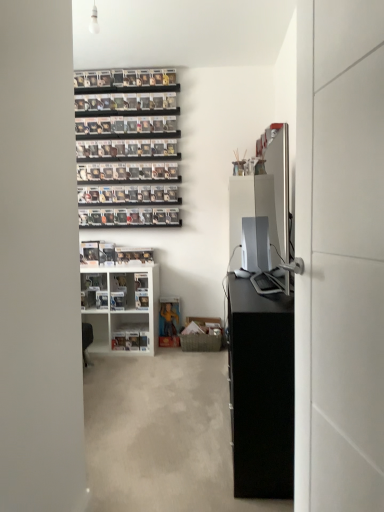
What do you see at coordinates (261, 390) in the screenshot? This screenshot has width=384, height=512. I see `black matte cabinet at right` at bounding box center [261, 390].

The image size is (384, 512). I want to click on white glossy door at right, so click(339, 256).

Locate an element on the screen. The width and height of the screenshot is (384, 512). satin silver desktop at center is located at coordinates (255, 244).

How much space does white glossy shelf at center, which appears as the second shelf when ordered from the bottom, occupy vertically?

white glossy shelf at center, which appears as the second shelf when ordered from the bottom, is 29.50 inches tall.

Measure the distance between point [116,335] and camera.

The depth of point [116,335] is 11.99 feet.

The height and width of the screenshot is (512, 384). I want to click on white plastic shelf at lower center, which appears as the first shelf when ordered from the bottom, so click(130, 332).

Locate an element on the screen. black matte cabinet at right is located at coordinates (261, 390).

What's the angular difference between white glossy door at right and white glossy shelf at center, which appears as the second shelf when ordered from the bottom,'s facing directions?

There is a 77.9-degree angle between the facing directions of white glossy door at right and white glossy shelf at center, which appears as the second shelf when ordered from the bottom.

The image size is (384, 512). In order to click on shelf that is the 2nd one when counting leftward from the white glossy door at right in this screenshot , I will do `click(122, 307)`.

Which is in front, white glossy door at right or white glossy shelf at center, which appears as the second shelf when ordered from the bottom?

Positioned in front is white glossy door at right.

Looking at this image, considering the sizes of objects white glossy door at right and white glossy shelf at center, which is counted as the first shelf, starting from the top, in the image provided, who is smaller, white glossy door at right or white glossy shelf at center, which is counted as the first shelf, starting from the top,?

With smaller size is white glossy door at right.

What's the angular difference between white glossy shelf at center, which is counted as the first shelf, starting from the top, and black matte cabinet at right's facing directions?

89.5 degrees.

Does white glossy shelf at center, which is counted as the first shelf, starting from the top, appear on the right side of black matte cabinet at right?

In fact, white glossy shelf at center, which is counted as the first shelf, starting from the top, is to the left of black matte cabinet at right.

You are a GUI agent. You are given a task and a screenshot of the screen. Output one action in this format:
    pyautogui.click(x=<x>, y=<y>)
    Task: Click on the shelf above the black matte cabinet at right (from the image's perspective)
    
    Given the screenshot: What is the action you would take?
    click(122, 307)

Which is correct: white glossy shelf at center, which appears as the second shelf when ordered from the bottom, is inside black matte cabinet at right, or outside of it?

white glossy shelf at center, which appears as the second shelf when ordered from the bottom, is not enclosed by black matte cabinet at right.

Is white glossy door at right facing away from white plastic shelf at lower center, the 2th shelf when ordered from top to bottom?

No.

Which of these two, white glossy door at right or white plastic shelf at lower center, the 2th shelf when ordered from top to bottom, stands shorter?

With less height is white plastic shelf at lower center, the 2th shelf when ordered from top to bottom.

Is white glossy door at right situated inside white plastic shelf at lower center, which appears as the first shelf when ordered from the bottom, or outside?

white glossy door at right is spatially situated outside white plastic shelf at lower center, which appears as the first shelf when ordered from the bottom.

From a real-world perspective, which object stands above the other?

white glossy door at right.

Considering the positions of point (333, 292) and point (244, 423), is point (333, 292) closer or farther from the camera than point (244, 423)?

Point (333, 292) appears to be closer to the viewer than point (244, 423).

From the image's perspective, would you say white glossy door at right is positioned over black matte cabinet at right?

Correct, white glossy door at right appears higher than black matte cabinet at right in the image.

Find the location of `glass door on the left of the black matte cabinet at right`. glass door on the left of the black matte cabinet at right is located at coordinates (339, 256).

How different are the orientations of satin silver desktop at center and white glossy shelf at center, which is counted as the first shelf, starting from the top, in degrees?

Result: They differ by 89.6 degrees in their facing directions.

Is satin silver desktop at center facing towards white glossy shelf at center, which appears as the second shelf when ordered from the bottom?

No, satin silver desktop at center is not facing towards white glossy shelf at center, which appears as the second shelf when ordered from the bottom.

Which is closer, (267, 236) or (95, 292)?

Point (267, 236).

In the scene shown: Considering their positions, is satin silver desktop at center located in front of or behind white glossy shelf at center, which is counted as the first shelf, starting from the top?

Clearly, satin silver desktop at center is in front of white glossy shelf at center, which is counted as the first shelf, starting from the top.

This screenshot has height=512, width=384. Find the location of `shelf that is the 1st one when counting downward from the satin silver desktop at center (from the image's perspective)`. shelf that is the 1st one when counting downward from the satin silver desktop at center (from the image's perspective) is located at coordinates (122, 307).

Is white glossy shelf at center, which is counted as the first shelf, starting from the top, next to satin silver desktop at center and touching it?

white glossy shelf at center, which is counted as the first shelf, starting from the top, and satin silver desktop at center are not in contact.

Considering the sizes of objects white glossy shelf at center, which is counted as the first shelf, starting from the top, and satin silver desktop at center in the image provided, who is taller, white glossy shelf at center, which is counted as the first shelf, starting from the top, or satin silver desktop at center?

white glossy shelf at center, which is counted as the first shelf, starting from the top.

Which is more to the left, white glossy shelf at center, which is counted as the first shelf, starting from the top, or satin silver desktop at center?

From the viewer's perspective, white glossy shelf at center, which is counted as the first shelf, starting from the top, appears more on the left side.

Consider the image. Which of these two, black matte cabinet at right or white glossy shelf at center, which appears as the second shelf when ordered from the bottom, is smaller?

Smaller between the two is white glossy shelf at center, which appears as the second shelf when ordered from the bottom.

From the image's perspective, between black matte cabinet at right and white glossy shelf at center, which appears as the second shelf when ordered from the bottom, which one is located above?

From the image's view, white glossy shelf at center, which appears as the second shelf when ordered from the bottom, is above.

Does point (246, 288) appear closer or farther from the camera than point (122, 319)?

Point (246, 288) appears to be closer to the viewer than point (122, 319).

Image resolution: width=384 pixels, height=512 pixels. I want to click on cabinetry that appears in front of the white glossy shelf at center, which appears as the second shelf when ordered from the bottom, so click(261, 390).

Locate an element on the screen. This screenshot has width=384, height=512. the 1st shelf below the white glossy door at right (from the image's perspective) is located at coordinates (122, 307).

Find the location of `shelf above the black matte cabinet at right (from a real-world perspective)`. shelf above the black matte cabinet at right (from a real-world perspective) is located at coordinates (122, 307).

Based on their spatial positions, is white glossy shelf at center, which is counted as the first shelf, starting from the top, or white glossy door at right closer to white plastic shelf at lower center, the 2th shelf when ordered from top to bottom?

Among the two, white glossy shelf at center, which is counted as the first shelf, starting from the top, is located nearer to white plastic shelf at lower center, the 2th shelf when ordered from top to bottom.

Looking at the image, which one is located closer to white glossy door at right, satin silver desktop at center or white plastic shelf at lower center, the 2th shelf when ordered from top to bottom?

satin silver desktop at center is closer to white glossy door at right.

Based on their spatial positions, is white plastic shelf at lower center, the 2th shelf when ordered from top to bottom, or black matte cabinet at right closer to white glossy shelf at center, which is counted as the first shelf, starting from the top?

white plastic shelf at lower center, the 2th shelf when ordered from top to bottom, is positioned closer to the anchor white glossy shelf at center, which is counted as the first shelf, starting from the top.

Which object lies further to the anchor point black matte cabinet at right, satin silver desktop at center or white glossy door at right?

satin silver desktop at center is positioned further to the anchor black matte cabinet at right.

Based on the photo, which object lies nearer to the anchor point white glossy shelf at center, which is counted as the first shelf, starting from the top, white glossy door at right or black matte cabinet at right?

The object closer to white glossy shelf at center, which is counted as the first shelf, starting from the top, is black matte cabinet at right.

When comparing their distances from white glossy door at right, does black matte cabinet at right or satin silver desktop at center seem further?

satin silver desktop at center is positioned further to the anchor white glossy door at right.

Estimate the real-world distances between objects in this image. Which object is closer to white glossy shelf at center, which is counted as the first shelf, starting from the top, satin silver desktop at center or black matte cabinet at right?

Based on the image, satin silver desktop at center appears to be nearer to white glossy shelf at center, which is counted as the first shelf, starting from the top.

Considering their positions, is satin silver desktop at center positioned closer to white plastic shelf at lower center, the 2th shelf when ordered from top to bottom, than white glossy door at right?

satin silver desktop at center is closer to white plastic shelf at lower center, the 2th shelf when ordered from top to bottom.

Find the location of a particular element. This screenshot has height=512, width=384. desktop computer between black matte cabinet at right and white plastic shelf at lower center, the 2th shelf when ordered from top to bottom, from front to back is located at coordinates (255, 244).

Locate an element on the screen. This screenshot has width=384, height=512. desktop computer between black matte cabinet at right and white glossy shelf at center, which is counted as the first shelf, starting from the top, along the z-axis is located at coordinates (255, 244).

Find the location of a particular element. This screenshot has width=384, height=512. shelf between black matte cabinet at right and white plastic shelf at lower center, the 2th shelf when ordered from top to bottom, from front to back is located at coordinates (122, 307).

Where is `shelf between white glossy door at right and white plastic shelf at lower center, which appears as the first shelf when ordered from the bottom, in the front-back direction`? The width and height of the screenshot is (384, 512). shelf between white glossy door at right and white plastic shelf at lower center, which appears as the first shelf when ordered from the bottom, in the front-back direction is located at coordinates (122, 307).